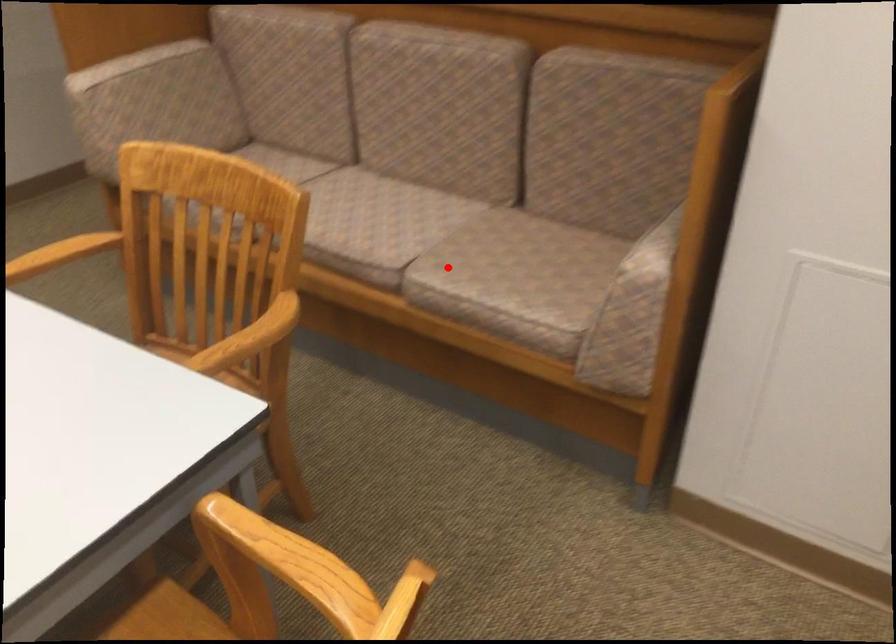
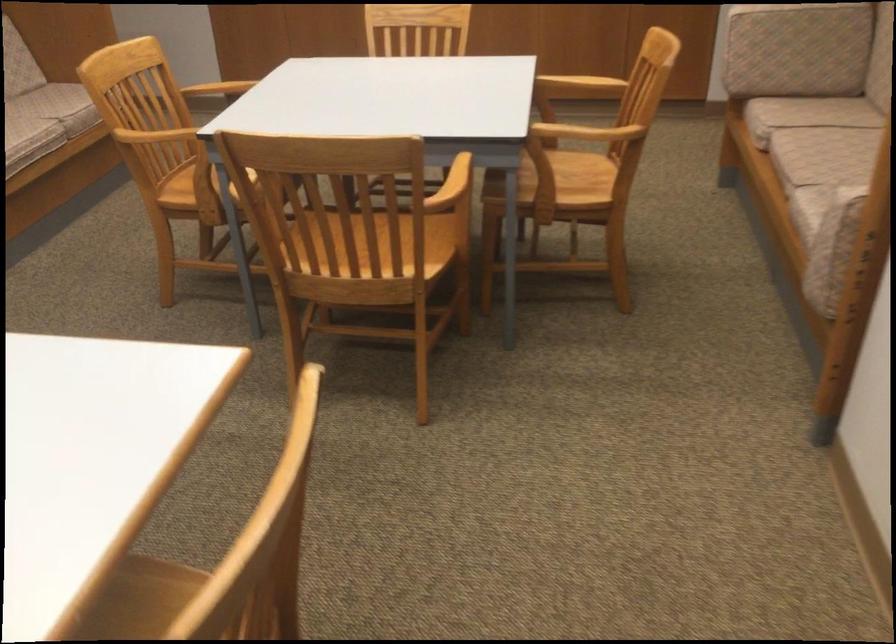
Question: A red point is marked in image1. In image2, is the corresponding 3D point closer to the camera or farther? Reply with the corresponding letter.

Choices:
 (A) The corresponding 3D point is closer.
 (B) The corresponding 3D point is farther.

Answer: (B)